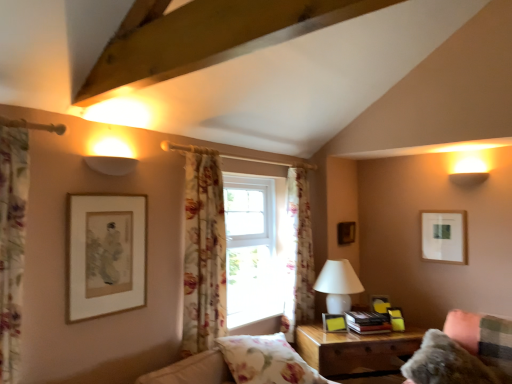
Question: From the image's perspective, is fuzzy fabric couch at lower right located beneath matte gold picture frame at lower right, which appears as the third picture frame when viewed from the front?

Choices:
 (A) yes
 (B) no

Answer: (A)

Question: Can matte gold picture frame at lower right, which appears as the third picture frame when viewed from the front, be found inside fuzzy fabric couch at lower right?

Choices:
 (A) yes
 (B) no

Answer: (B)

Question: Is fuzzy fabric couch at lower right positioned behind matte gold picture frame at lower right, which appears as the third picture frame when viewed from the front?

Choices:
 (A) no
 (B) yes

Answer: (A)

Question: Is fuzzy fabric couch at lower right positioned beyond the bounds of matte gold picture frame at lower right, marked as the 4th picture frame in a back-to-front arrangement?

Choices:
 (A) no
 (B) yes

Answer: (B)

Question: Is fuzzy fabric couch at lower right bigger than matte gold picture frame at lower right, acting as the 5th picture frame starting from the left?

Choices:
 (A) yes
 (B) no

Answer: (A)

Question: In terms of size, does white matte picture frame at upper right, which is the second picture frame in back-to-front order, appear bigger or smaller than wooden picture frame at upper right, marked as the fourth picture frame in a right-to-left arrangement?

Choices:
 (A) small
 (B) big

Answer: (B)

Question: Relative to wooden picture frame at upper right, positioned as the 1th picture frame in back-to-front order, is white matte picture frame at upper right, which is the second picture frame in back-to-front order, in front or behind?

Choices:
 (A) behind
 (B) front

Answer: (B)

Question: Would you say white matte picture frame at upper right, which appears as the fifth picture frame when viewed from the front, is to the left or to the right of wooden picture frame at upper right, marked as the fourth picture frame in a right-to-left arrangement, in the picture?

Choices:
 (A) left
 (B) right

Answer: (B)

Question: Is white matte picture frame at upper right, the first picture frame in the right-to-left sequence, inside or outside of wooden picture frame at upper right, marked as the fourth picture frame in a right-to-left arrangement?

Choices:
 (A) inside
 (B) outside

Answer: (B)

Question: From a real-world perspective, is floral fabric curtain at center, which appears as the second curtain when viewed from the right, above or below matte gold picture frame at left, which is counted as the 6th picture frame, starting from the right?

Choices:
 (A) below
 (B) above

Answer: (A)

Question: From their relative heights in the image, would you say floral fabric curtain at center, which appears as the second curtain when viewed from the right, is taller or shorter than matte gold picture frame at left, the sixth picture frame from the back?

Choices:
 (A) tall
 (B) short

Answer: (A)

Question: In the image, is floral fabric curtain at center, the second curtain when ordered from back to front, on the left side or the right side of matte gold picture frame at left, which is counted as the 6th picture frame, starting from the right?

Choices:
 (A) right
 (B) left

Answer: (A)

Question: Is floral fabric curtain at center, placed as the second curtain when sorted from front to back, wider or thinner than matte gold picture frame at left, positioned as the first picture frame in left-to-right order?

Choices:
 (A) thin
 (B) wide

Answer: (B)

Question: Visually, is floral fabric pillow at lower center positioned to the left or to the right of matte yellow picture frame at right, positioned as the 2th picture frame in left-to-right order?

Choices:
 (A) right
 (B) left

Answer: (B)

Question: Considering the positions of floral fabric pillow at lower center and matte yellow picture frame at right, which is counted as the fifth picture frame, starting from the right, in the image, is floral fabric pillow at lower center bigger or smaller than matte yellow picture frame at right, which is counted as the fifth picture frame, starting from the right,?

Choices:
 (A) small
 (B) big

Answer: (B)